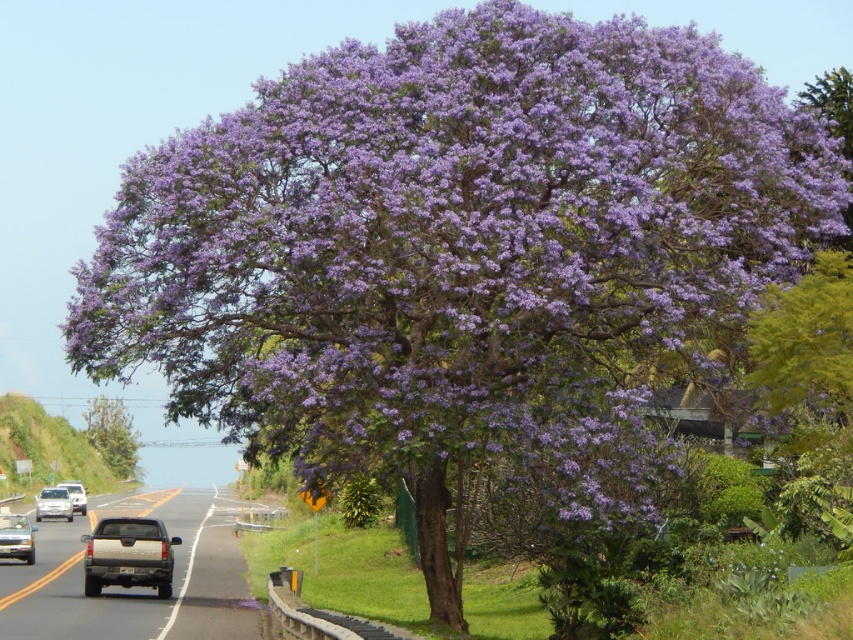
Question: Which object is the farthest from the silver metallic truck at lower left?

Choices:
 (A) white matte truck at center
 (B) green leafy tree at left
 (C) gold metallic truck at center
 (D) silver metallic car at center-left

Answer: (B)

Question: Which point appears farthest from the camera in this image?

Choices:
 (A) (102, 400)
 (B) (32, 532)

Answer: (A)

Question: Does silver metallic truck at lower left have a lesser width compared to silver metallic car at center-left?

Choices:
 (A) no
 (B) yes

Answer: (B)

Question: Can you confirm if gray metallic truck at center is positioned above gold metallic truck at center?

Choices:
 (A) yes
 (B) no

Answer: (B)

Question: Among these objects, which one is nearest to the camera?

Choices:
 (A) silver metallic truck at lower left
 (B) green leafy tree at left
 (C) silver metallic car at center-left
 (D) gray metallic truck at center

Answer: (D)

Question: Can you confirm if green leafy tree at left is wider than silver metallic truck at lower left?

Choices:
 (A) no
 (B) yes

Answer: (B)